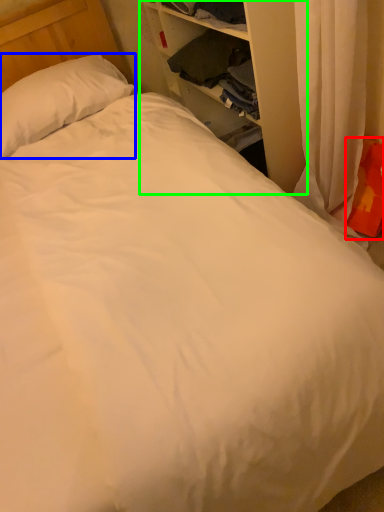
Question: Based on their relative distances, which object is nearer to pillow (highlighted by a red box)? Choose from pillow (highlighted by a blue box) and dresser (highlighted by a green box).

Choices:
 (A) pillow
 (B) dresser

Answer: (B)